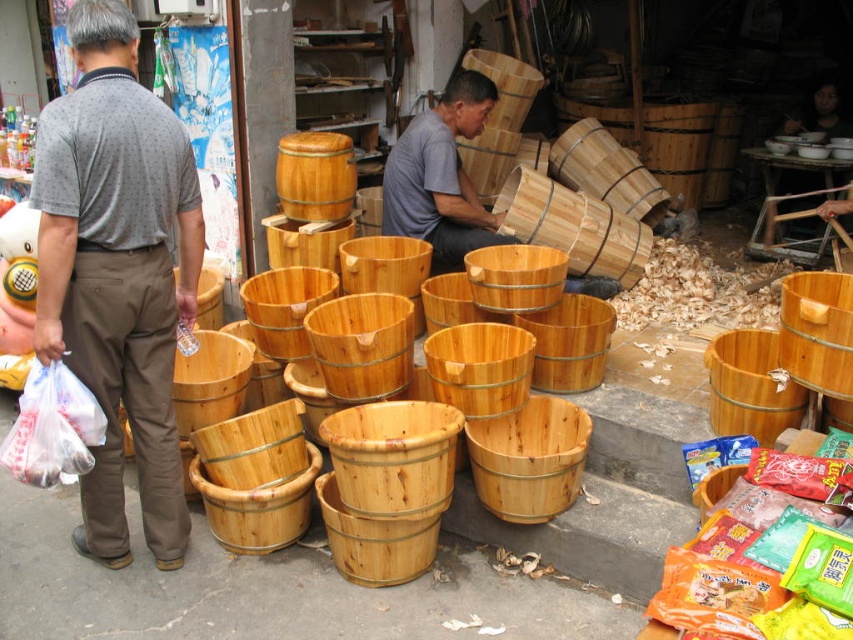
Question: Can you confirm if matte gray shirt at left is thinner than wooden bucket at center?

Choices:
 (A) no
 (B) yes

Answer: (B)

Question: Among these points, which one is farthest from the camera?

Choices:
 (A) (549, 285)
 (B) (163, 280)
 (C) (445, 177)

Answer: (C)

Question: Is matte gray shirt at left positioned in front of wooden bucket at center?

Choices:
 (A) no
 (B) yes

Answer: (B)

Question: Among these points, which one is farthest from the camera?

Choices:
 (A) (132, 317)
 (B) (505, 240)

Answer: (B)

Question: Which of these objects is positioned closest to the natural wood bucket at center?

Choices:
 (A) wooden bucket at center
 (B) matte gray shirt at left

Answer: (A)

Question: Is the position of natural wood bucket at center more distant than that of wooden bucket at center?

Choices:
 (A) yes
 (B) no

Answer: (B)